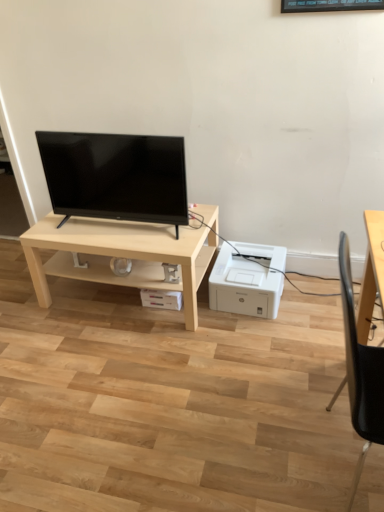
Question: Looking at the image, does white plastic printer at lower right seem bigger or smaller compared to black plastic chair at right?

Choices:
 (A) small
 (B) big

Answer: (A)

Question: From the image's perspective, is white plastic printer at lower right above or below black plastic chair at right?

Choices:
 (A) below
 (B) above

Answer: (B)

Question: Considering the real-world distances, which object is closest to the white plastic printer at lower right?

Choices:
 (A) black glossy tv at center
 (B) light wood table at center
 (C) black plastic chair at right

Answer: (B)

Question: Estimate the real-world distances between objects in this image. Which object is closer to the light wood table at center?

Choices:
 (A) white plastic printer at lower right
 (B) black plastic chair at right
 (C) black glossy tv at center

Answer: (C)